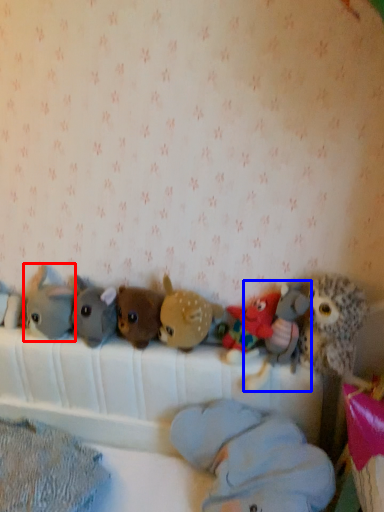
Question: Which object appears closest to the camera in this image, toy (highlighted by a red box) or toy (highlighted by a blue box)?

Choices:
 (A) toy
 (B) toy

Answer: (B)